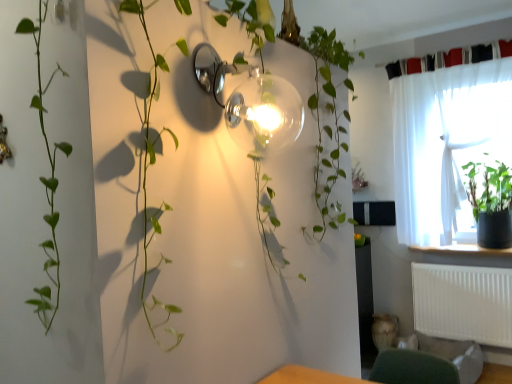
This screenshot has height=384, width=512. Find the location of `vacant area on top of black fabric curtain at upper right, which ranks as the second curtain in bottom-to-top order (from a real-world perspective)`. vacant area on top of black fabric curtain at upper right, which ranks as the second curtain in bottom-to-top order (from a real-world perspective) is located at coordinates (461, 45).